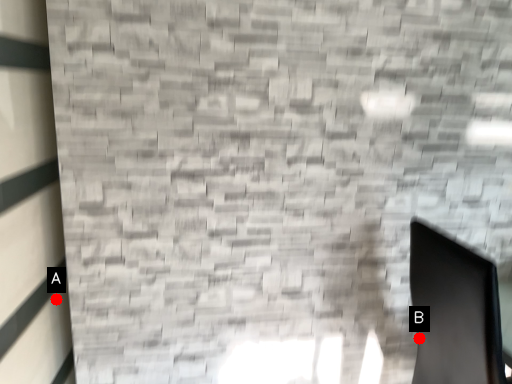
Question: Two points are circled on the image, labeled by A and B beside each circle. Among these points, which one is nearest to the camera?

Choices:
 (A) A is closer
 (B) B is closer

Answer: (A)